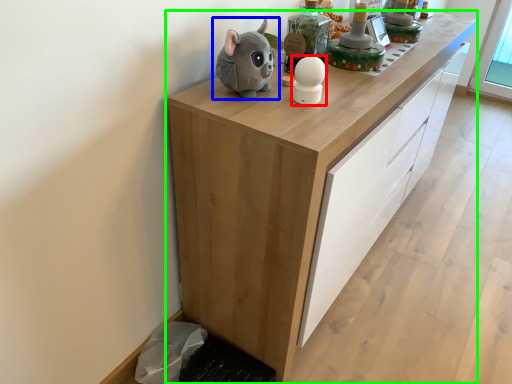
Question: Based on their relative distances, which object is nearer to toy (highlighted by a red box)? Choose from toy (highlighted by a blue box) and cabinetry (highlighted by a green box).

Choices:
 (A) toy
 (B) cabinetry

Answer: (A)